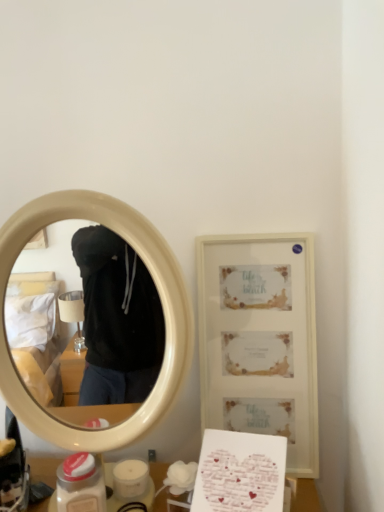
Question: Should I look upward or downward to see matte white table at lower center?

Choices:
 (A) down
 (B) up

Answer: (A)